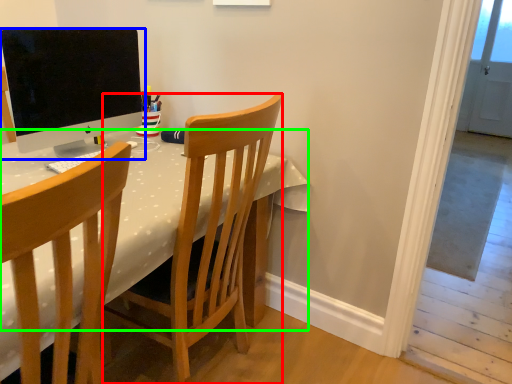
Question: Which is nearer to the chair (highlighted by a red box)? computer monitor (highlighted by a blue box) or table (highlighted by a green box).

Choices:
 (A) computer monitor
 (B) table

Answer: (B)